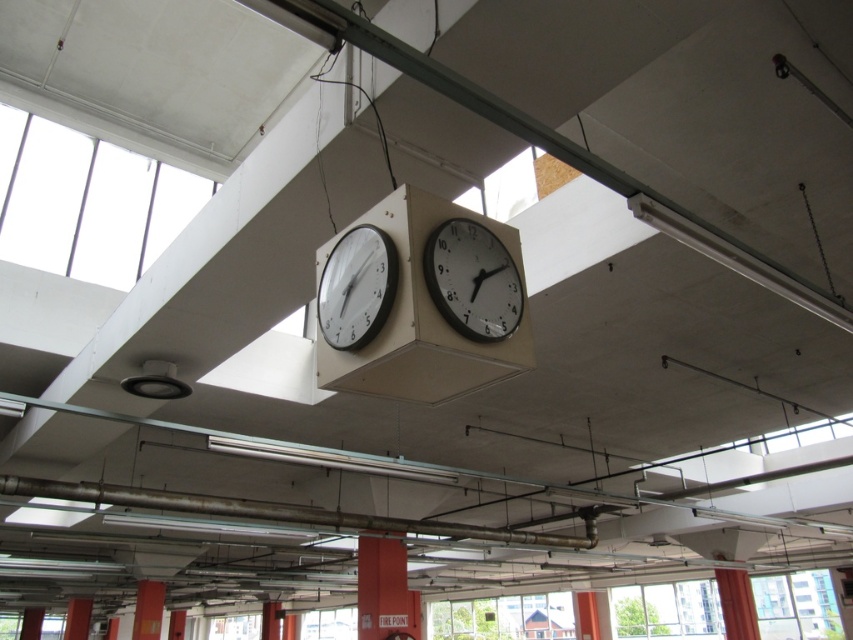
Question: Is white glossy clock at upper center below white plastic clock at center?

Choices:
 (A) yes
 (B) no

Answer: (B)

Question: Which point appears farthest from the camera in this image?

Choices:
 (A) (323, 268)
 (B) (520, 301)

Answer: (A)

Question: Can you confirm if white glossy clock at upper center is positioned to the right of white plastic clock at center?

Choices:
 (A) yes
 (B) no

Answer: (A)

Question: Observing the image, what is the correct spatial positioning of white glossy clock at upper center in reference to white plastic clock at center?

Choices:
 (A) left
 (B) right

Answer: (B)